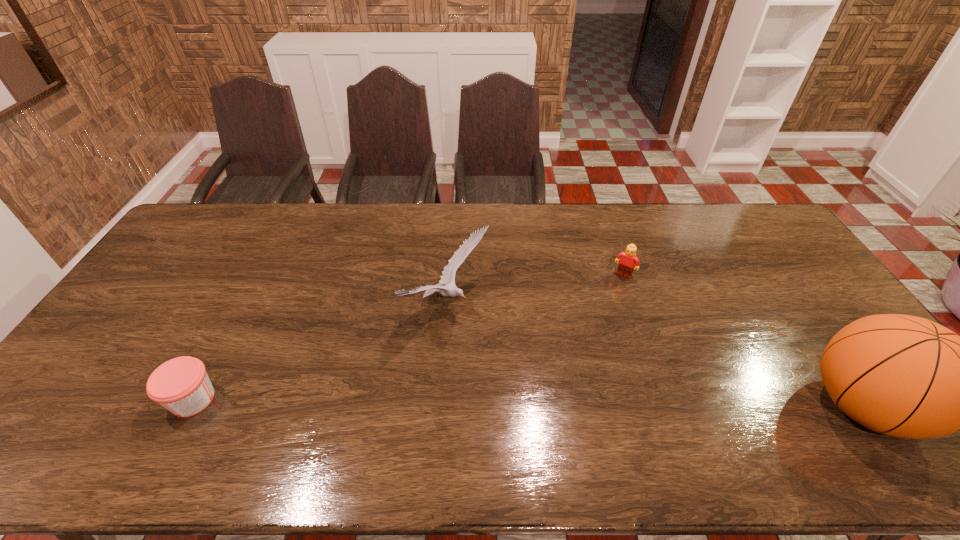
At what (x,y) coordinates should I click in order to perform the action: click on free space on the desktop that is between the jam and the basketball and is positioned on the face of the third object from left to right. Please return your answer as a coordinate pair (x, y). Looking at the image, I should click on (546, 403).

You are a GUI agent. You are given a task and a screenshot of the screen. Output one action in this format:
    pyautogui.click(x=<x>, y=<y>)
    Task: Click on the vacant space on the desktop that is between the jam and the rightmost object and is positioned at the tip of the beak of the second object from left to right
    
    Given the screenshot: What is the action you would take?
    pyautogui.click(x=606, y=403)